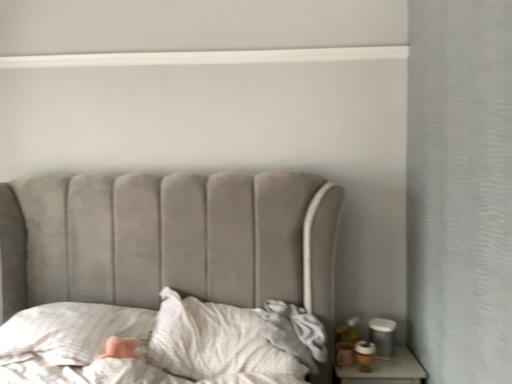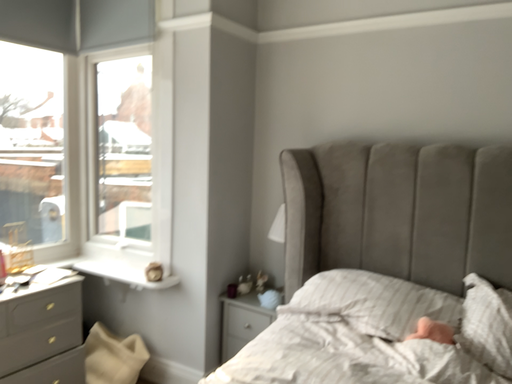
Question: Which way did the camera rotate in the video?

Choices:
 (A) rotated left
 (B) rotated right

Answer: (A)